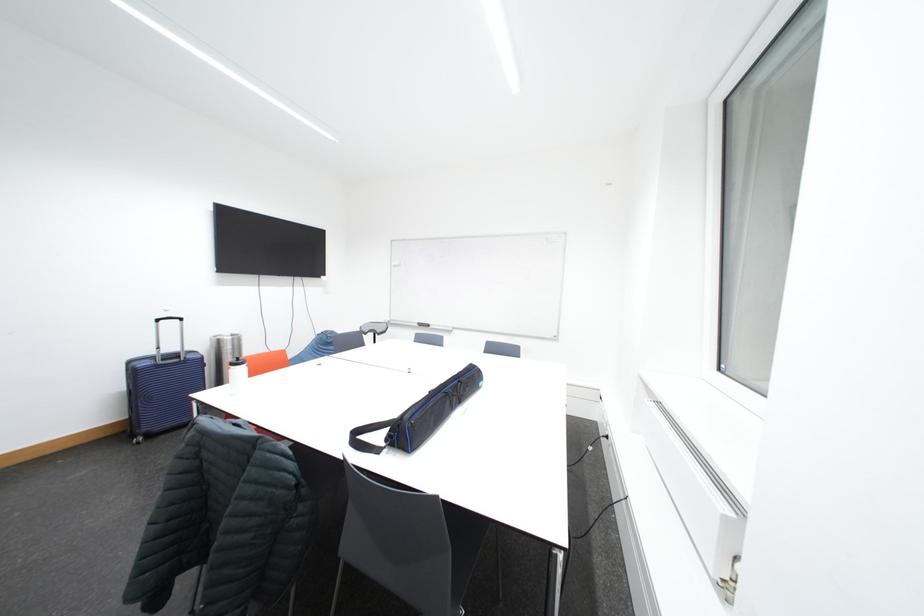
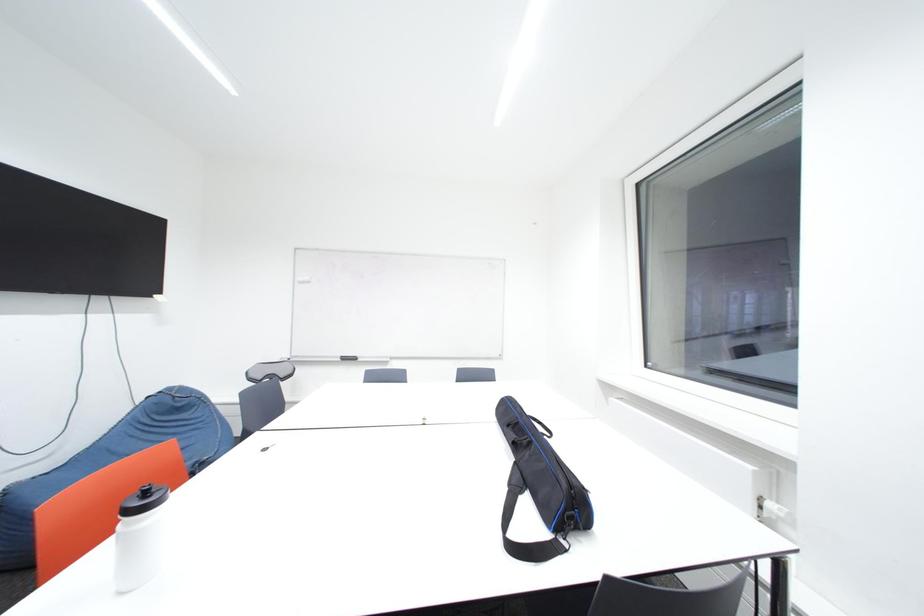
Question: The camera is either moving clockwise (left) or counter-clockwise (right) around the object. The first image is from the beginning of the video and the second image is from the end. Is the camera moving left or right when shooting the video?

Choices:
 (A) Left
 (B) Right

Answer: (A)